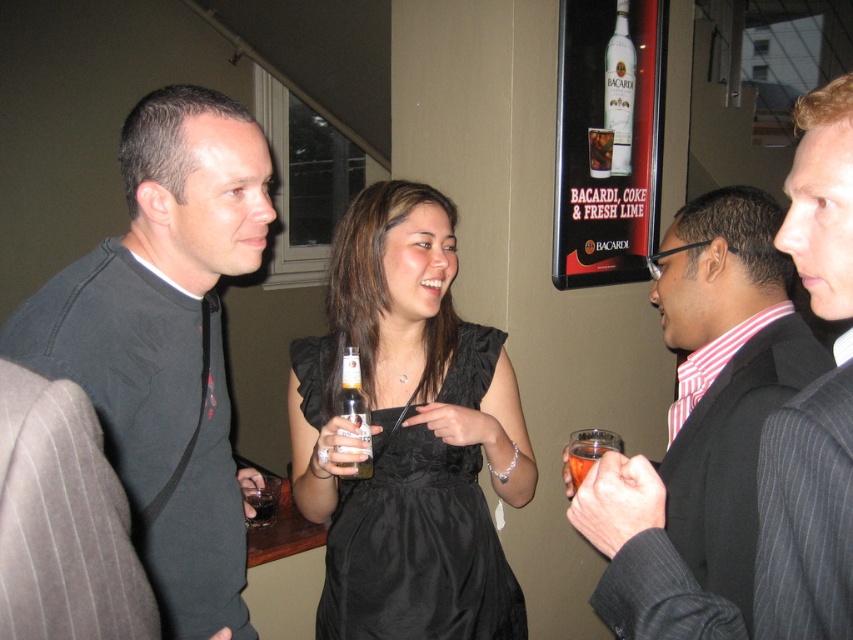
At what (x,y) coordinates should I click in order to perform the action: click on translucent glass bottle at center. Please return your answer as a coordinate pair (x, y). This screenshot has height=640, width=853. Looking at the image, I should click on (354, 406).

Is the position of translucent glass bottle at center less distant than that of translucent glass cup at lower center?

That is False.

This screenshot has width=853, height=640. Describe the element at coordinates (354, 406) in the screenshot. I see `translucent glass bottle at center` at that location.

At what (x,y) coordinates should I click in order to perform the action: click on translucent glass bottle at center. Please return your answer as a coordinate pair (x, y). Looking at the image, I should click on (354, 406).

Which is more to the left, striped cotton shirt at center or translucent glass at lower left?

Positioned to the left is translucent glass at lower left.

Who is higher up, striped cotton shirt at center or translucent glass at lower left?

striped cotton shirt at center is higher up.

Who is more forward, [799,365] or [257,524]?

Point [799,365]

You are a GUI agent. You are given a task and a screenshot of the screen. Output one action in this format:
    pyautogui.click(x=<x>, y=<y>)
    Task: Click on the striped cotton shirt at center
    
    Given the screenshot: What is the action you would take?
    pyautogui.click(x=711, y=396)

Is black satin dress at center positioned before white glass bottle at upper center?

Yes, black satin dress at center is closer to the viewer.

Which of these two, black satin dress at center or white glass bottle at upper center, stands shorter?

white glass bottle at upper center

Is point (424, 552) farther from camera compared to point (608, 116)?

No, it is not.

Find the location of a particular element. black satin dress at center is located at coordinates (416, 547).